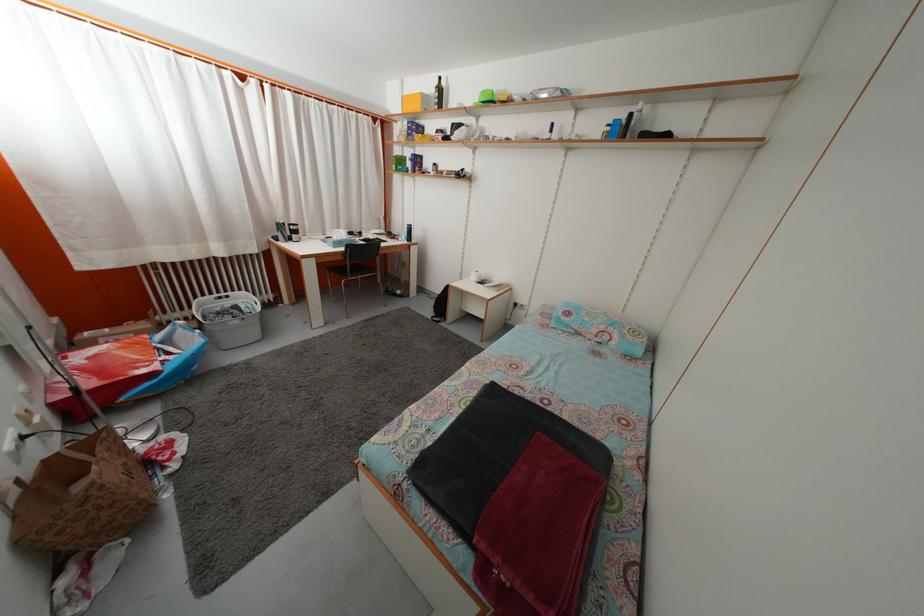
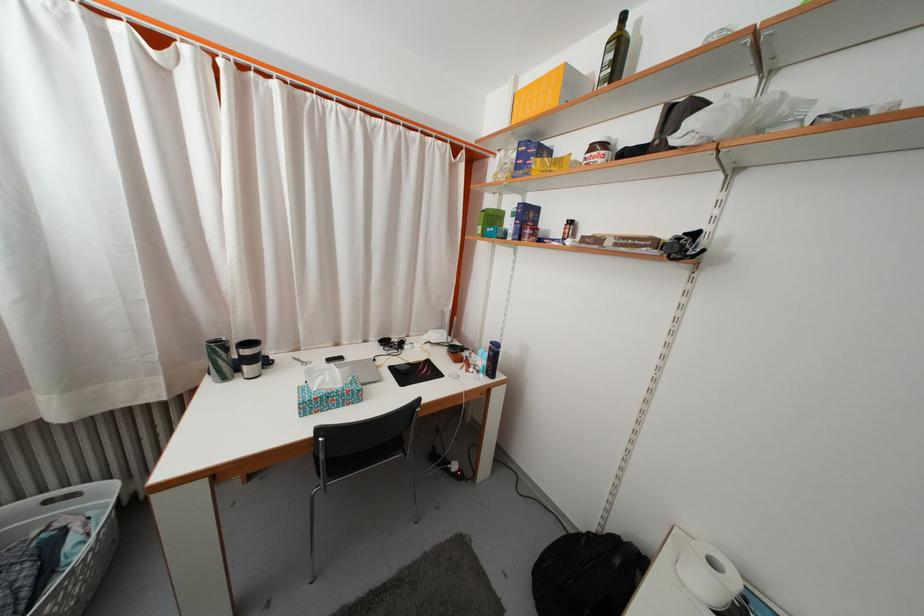
In the second image, find the point that corresponds to [286,233] in the first image.

(225, 354)